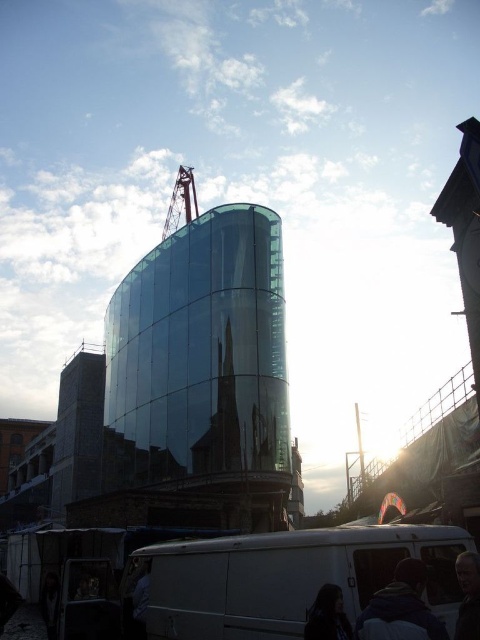
You are a construction worker who needs to place a 1.5 meter tall safety sign between the transparent glass tower at center and the dark brown leather jacket at lower right. Which object should the sign be placed closer to, considering their heights?

The transparent glass tower at center is taller than the dark brown leather jacket at lower right. Therefore, the safety sign should be placed closer to the dark brown leather jacket at lower right to ensure visibility from the ground level.

You are standing in front of the modern glass building under construction and see two points marked on the facade. The first point is at coordinate point (332, 582) and the second at point (190, 182). Which point is closer to you?

Point (332, 582) is closer to the viewer than point (190, 182).